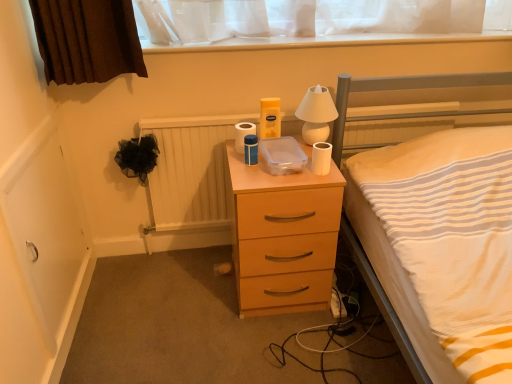
Image resolution: width=512 pixels, height=384 pixels. Identify the location of vacant space to the left of white matte toilet paper at right, which ranks as the 1th toilet paper in front-to-back order. (273, 177).